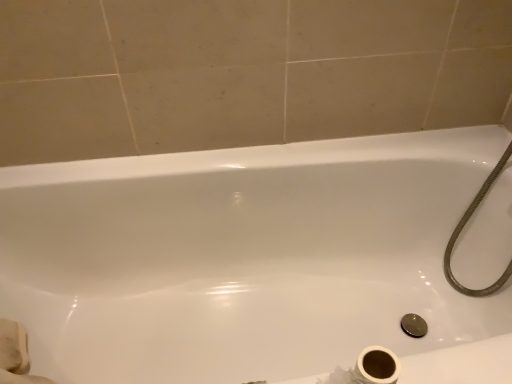
What do you see at coordinates (251, 261) in the screenshot?
I see `white glossy bathtub at center` at bounding box center [251, 261].

You are a GUI agent. You are given a task and a screenshot of the screen. Output one action in this format:
    pyautogui.click(x=<x>, y=<y>)
    Task: Click on the white glossy bathtub at center
    
    Given the screenshot: What is the action you would take?
    pyautogui.click(x=251, y=261)

You are a GUI agent. You are given a task and a screenshot of the screen. Output one action in this format:
    pyautogui.click(x=<x>, y=<y>)
    Task: Click on the white glossy bathtub at center
    Image resolution: width=512 pixels, height=384 pixels.
    Given the screenshot: What is the action you would take?
    pyautogui.click(x=251, y=261)